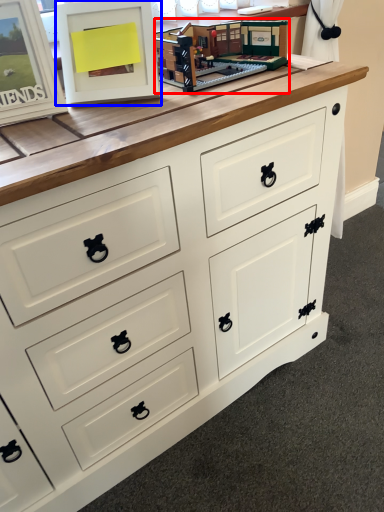
Question: Which object appears farthest to the camera in this image, toy (highlighted by a red box) or picture frame (highlighted by a blue box)?

Choices:
 (A) toy
 (B) picture frame

Answer: (A)